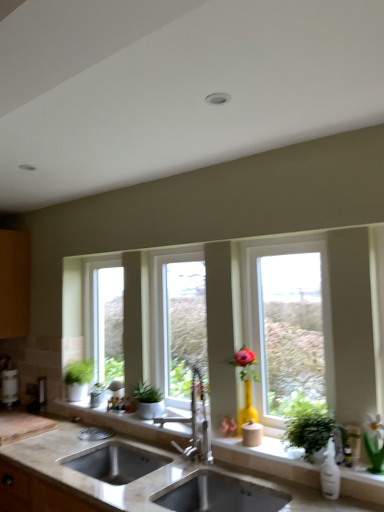
The width and height of the screenshot is (384, 512). I want to click on free spot below satin nickel faucet at center (from a real-world perspective), so [184, 466].